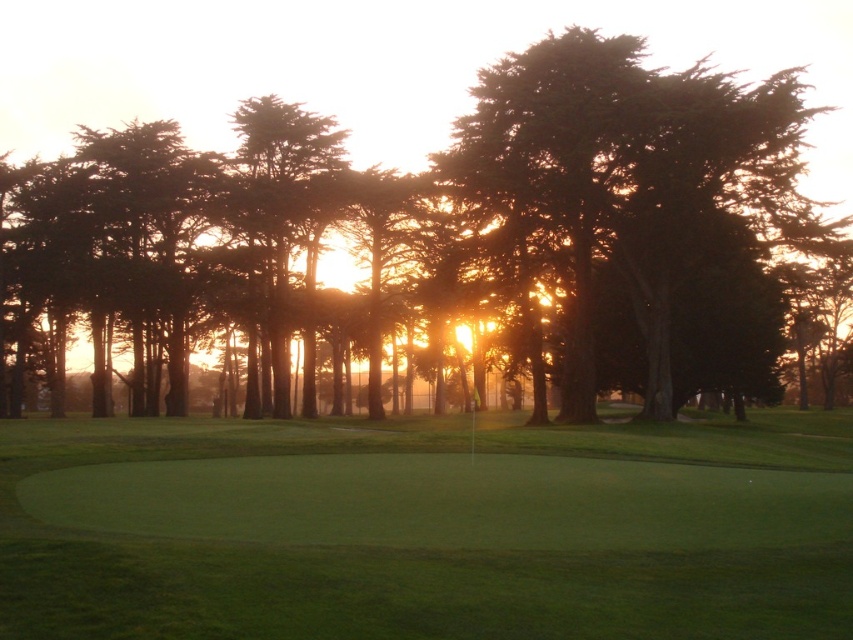
You are a golfer standing on the green and want to hit the ball towards the flagstick. Considering the green smooth grass at center and the green leafy tree at center, which object is closer to you as you aim?

The green smooth grass at center is closer to the viewer than the green leafy tree at center, so the green smooth grass at center is closer to you as you aim.

You are a golfer standing at the point marked as point (425,529) on the golf course. You want to putt the ball towards the flagstick located at the center of the green. Considering the slope of the terrain, will the ball roll towards the flagstick or away from it?

The ball will roll towards the flagstick because the point (425,529) is located on the green smooth grass at center, which is flat and level, allowing the ball to roll smoothly towards the target.

Based on the photo, you are standing at the point closer to the camera in the image. Which point are you at, point (264, 435) or point (387, 58)?

You are at point (264, 435) because it is closer to the camera than point (387, 58).